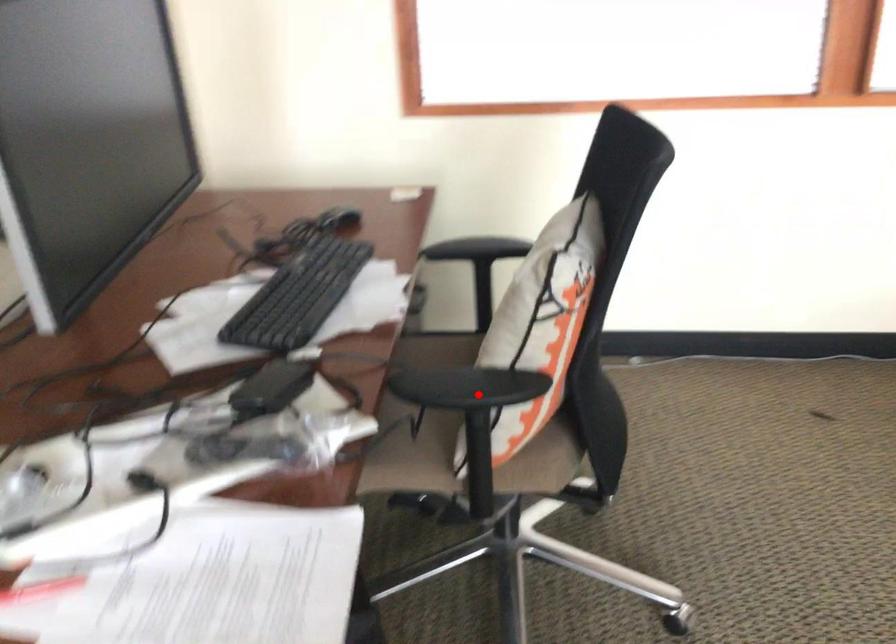
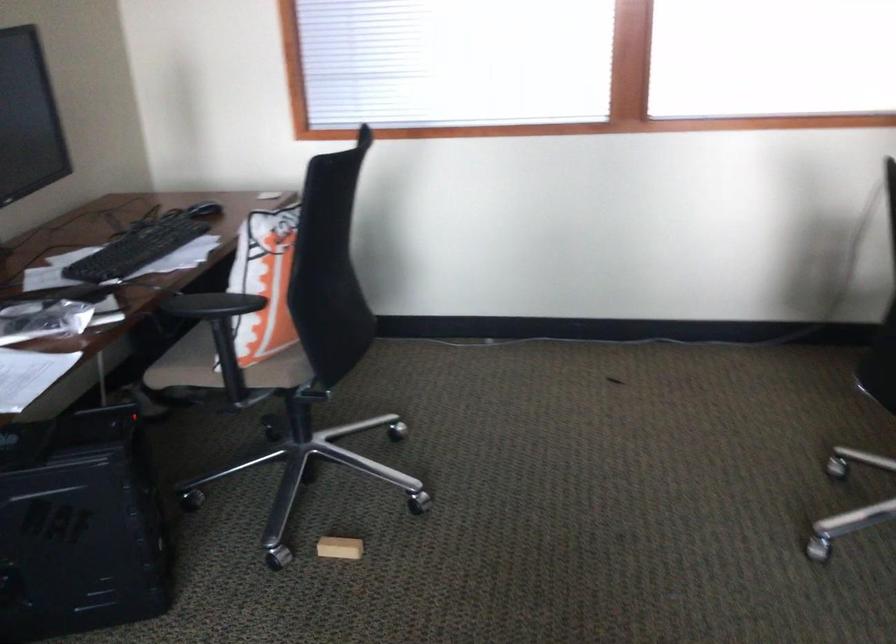
Question: I am providing you with two images of the same scene from different viewpoints. Given a red point in image1, look at the same physical point in image2. Is it:

Choices:
 (A) Closer to the viewpoint
 (B) Farther from the viewpoint

Answer: (B)